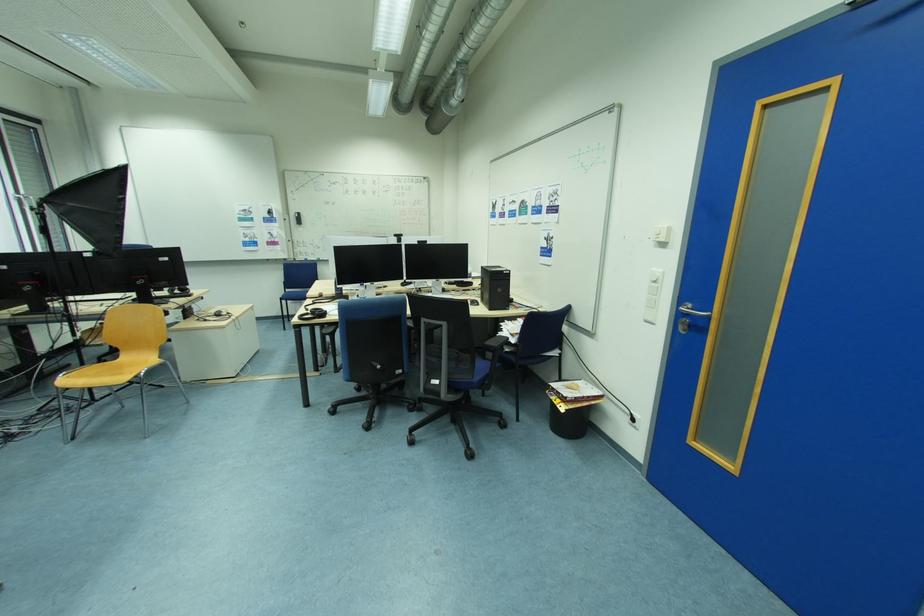
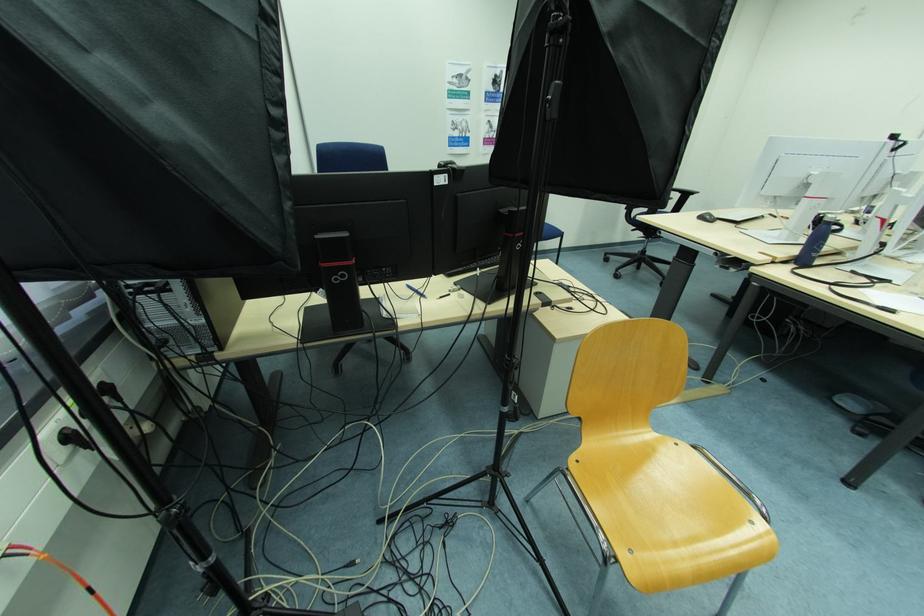
What movement of the cameraman would produce the second image?

The movement direction of the cameraman is left, forward.